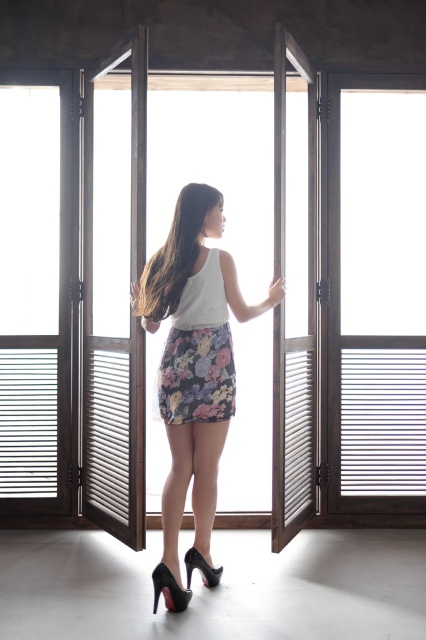
You are standing at the point closest to the doors in the scene. Which of the two points, point (25, 99) or point (213, 474), is farther away from you?

Point (25, 99) is behind point (213, 474), so it is farther away from you.